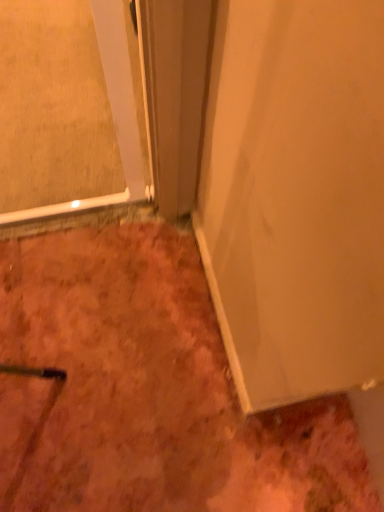
Question: Should I look upward or downward to see clear glass door at upper left?

Choices:
 (A) up
 (B) down

Answer: (A)

Question: Does white matte door at center have a lesser width compared to dull orange carpet at lower left?

Choices:
 (A) yes
 (B) no

Answer: (A)

Question: Can you confirm if white matte door at center is wider than dull orange carpet at lower left?

Choices:
 (A) yes
 (B) no

Answer: (B)

Question: Could you tell me if white matte door at center is turned towards dull orange carpet at lower left?

Choices:
 (A) no
 (B) yes

Answer: (B)

Question: Considering the relative sizes of white matte door at center and dull orange carpet at lower left in the image provided, is white matte door at center smaller than dull orange carpet at lower left?

Choices:
 (A) no
 (B) yes

Answer: (B)

Question: From the image's perspective, is white matte door at center below dull orange carpet at lower left?

Choices:
 (A) no
 (B) yes

Answer: (A)

Question: Does white matte door at center have a lesser height compared to dull orange carpet at lower left?

Choices:
 (A) yes
 (B) no

Answer: (B)

Question: From the image's perspective, is dull orange carpet at lower left beneath clear glass door at upper left?

Choices:
 (A) yes
 (B) no

Answer: (A)

Question: Can you confirm if dull orange carpet at lower left is positioned to the right of clear glass door at upper left?

Choices:
 (A) yes
 (B) no

Answer: (A)

Question: Does dull orange carpet at lower left lie in front of clear glass door at upper left?

Choices:
 (A) no
 (B) yes

Answer: (A)

Question: Can you confirm if dull orange carpet at lower left is wider than clear glass door at upper left?

Choices:
 (A) yes
 (B) no

Answer: (A)

Question: Is dull orange carpet at lower left at the left side of clear glass door at upper left?

Choices:
 (A) no
 (B) yes

Answer: (A)

Question: Is dull orange carpet at lower left outside clear glass door at upper left?

Choices:
 (A) yes
 (B) no

Answer: (A)

Question: Can you confirm if clear glass door at upper left is smaller than white matte door at center?

Choices:
 (A) no
 (B) yes

Answer: (B)